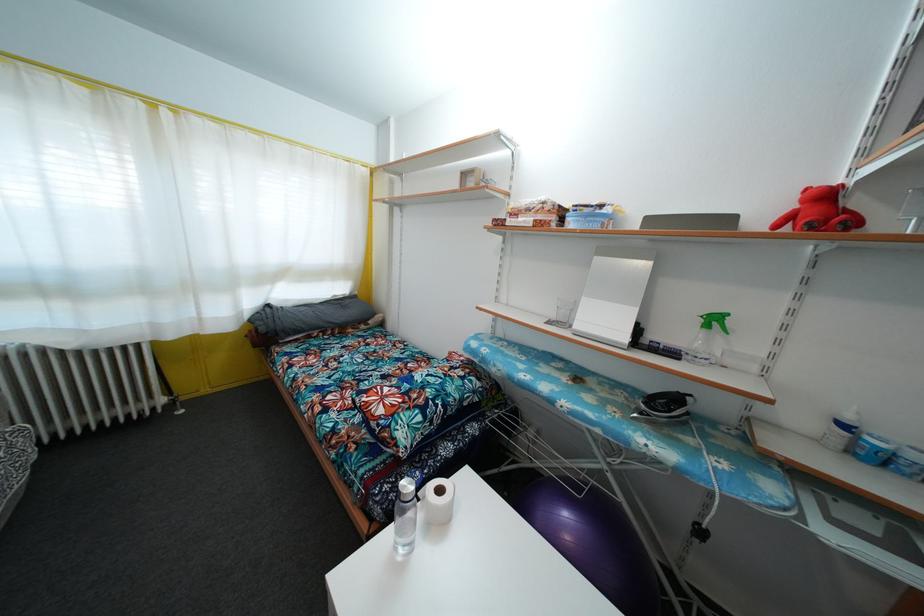
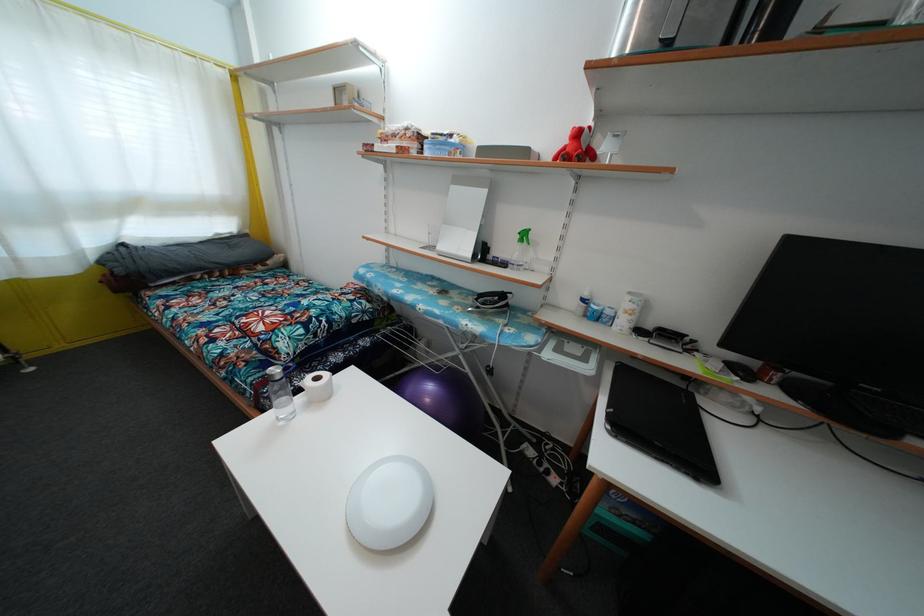
Locate, in the second image, the point that corresponds to point (718, 326) in the first image.

(528, 241)